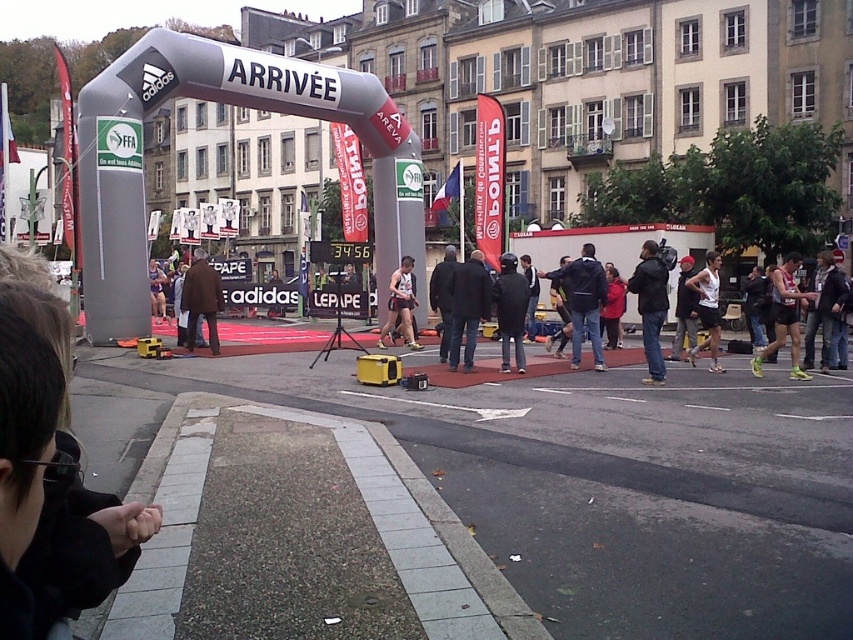
Can you confirm if dark blue jacket at center is positioned above white matte tank top at center?

Actually, dark blue jacket at center is below white matte tank top at center.

Between dark blue jacket at center and white matte tank top at center, which one has more height?

With more height is dark blue jacket at center.

Identify the location of dark blue jacket at center. This screenshot has width=853, height=640. coord(583,301).

Where is `dark blue jacket at center`? dark blue jacket at center is located at coordinates (583, 301).

Is matte black camera at center bigger than white matte tank top at center?

Indeed, matte black camera at center has a larger size compared to white matte tank top at center.

Who is lower down, matte black camera at center or white matte tank top at center?

Positioned lower is matte black camera at center.

Does point (646, 273) come behind point (715, 259)?

No, (646, 273) is in front of (715, 259).

Find the location of `matte black camera at center`. matte black camera at center is located at coordinates (651, 307).

Can you confirm if dark blue jacket at center is positioned to the right of matte black tank top at center?

Correct, you'll find dark blue jacket at center to the right of matte black tank top at center.

Is dark blue jacket at center thinner than matte black tank top at center?

Indeed, dark blue jacket at center has a lesser width compared to matte black tank top at center.

Which is behind, point (579, 296) or point (393, 273)?

The point (393, 273) is behind.

The image size is (853, 640). I want to click on dark blue jacket at center, so click(583, 301).